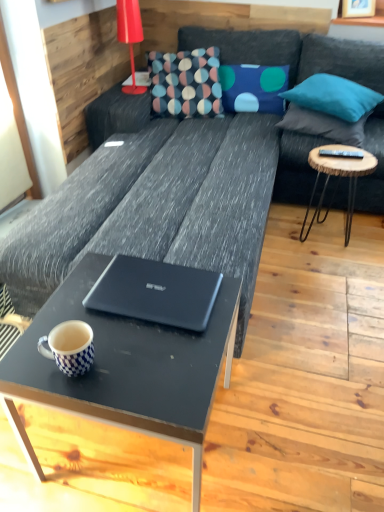
Find the location of `vacant space that is in between white checkered mug at lower left and matte black laptop at center`. vacant space that is in between white checkered mug at lower left and matte black laptop at center is located at coordinates pyautogui.click(x=129, y=343).